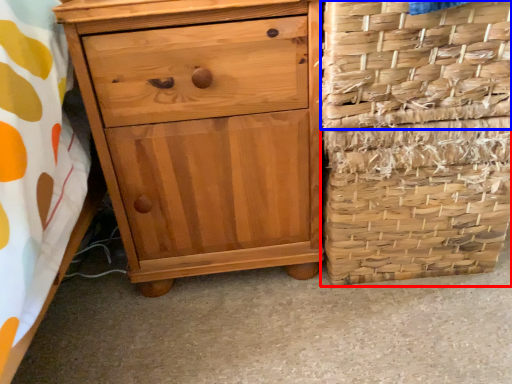
Question: Which object is closer to the camera taking this photo, basket container (highlighted by a red box) or basket (highlighted by a blue box)?

Choices:
 (A) basket container
 (B) basket

Answer: (B)